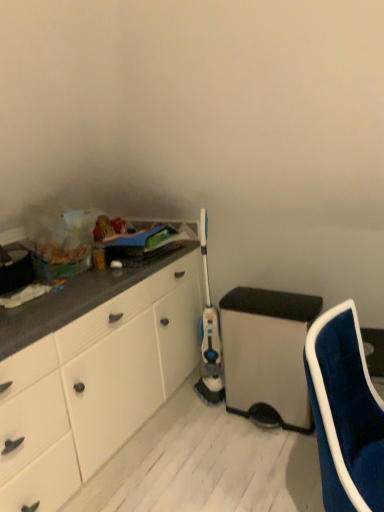
Question: Does velvet blue chair at lower right appear on the left side of matte plastic trash can at lower right?

Choices:
 (A) yes
 (B) no

Answer: (B)

Question: From the image's perspective, is velvet blue chair at lower right under matte plastic trash can at lower right?

Choices:
 (A) yes
 (B) no

Answer: (A)

Question: Can you confirm if velvet blue chair at lower right is bigger than matte plastic trash can at lower right?

Choices:
 (A) yes
 (B) no

Answer: (A)

Question: Is velvet blue chair at lower right turned away from matte plastic trash can at lower right?

Choices:
 (A) yes
 (B) no

Answer: (B)

Question: Would you say velvet blue chair at lower right contains matte plastic trash can at lower right?

Choices:
 (A) no
 (B) yes

Answer: (A)

Question: Considering the relative sizes of velvet blue chair at lower right and matte plastic trash can at lower right in the image provided, is velvet blue chair at lower right shorter than matte plastic trash can at lower right?

Choices:
 (A) no
 (B) yes

Answer: (A)

Question: Considering the relative positions of matte plastic trash can at lower right and velvet blue chair at lower right in the image provided, is matte plastic trash can at lower right in front of velvet blue chair at lower right?

Choices:
 (A) yes
 (B) no

Answer: (B)

Question: Does matte plastic trash can at lower right appear on the left side of velvet blue chair at lower right?

Choices:
 (A) no
 (B) yes

Answer: (B)

Question: Does matte plastic trash can at lower right have a lesser width compared to velvet blue chair at lower right?

Choices:
 (A) no
 (B) yes

Answer: (A)

Question: From a real-world perspective, is matte plastic trash can at lower right physically above velvet blue chair at lower right?

Choices:
 (A) no
 (B) yes

Answer: (A)

Question: Is matte plastic trash can at lower right smaller than velvet blue chair at lower right?

Choices:
 (A) yes
 (B) no

Answer: (A)

Question: Is matte plastic trash can at lower right next to velvet blue chair at lower right and touching it?

Choices:
 (A) yes
 (B) no

Answer: (B)

Question: From the image's perspective, is matte plastic trash can at lower right located above or below velvet blue chair at lower right?

Choices:
 (A) below
 (B) above

Answer: (B)